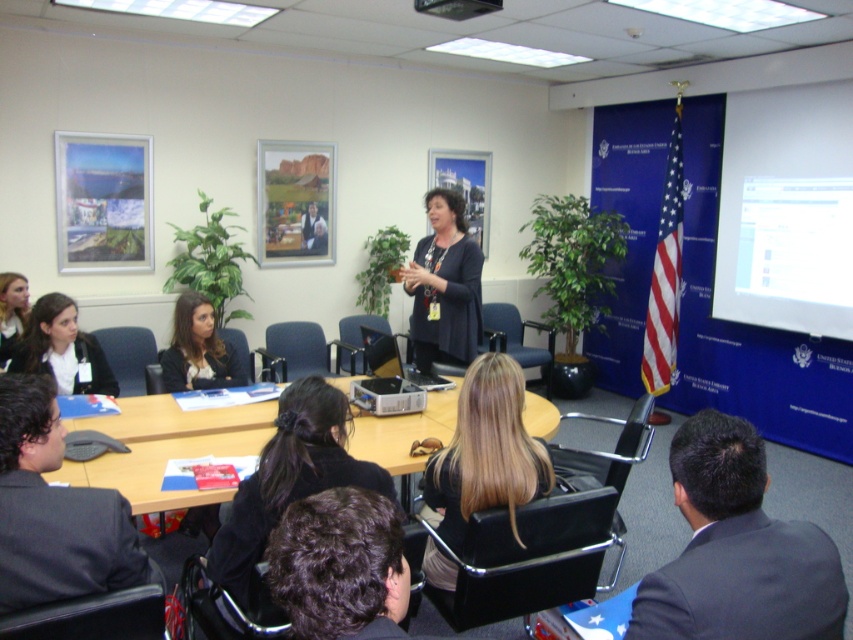
Is the position of dark gray suit at lower right more distant than that of black fabric hair at center?

No, dark gray suit at lower right is closer to the viewer.

Who is higher up, dark gray suit at lower right or black fabric hair at center?

dark gray suit at lower right is above.

Is point (680, 464) behind point (317, 456)?

No, (680, 464) is closer to viewer.

Identify the location of dark gray suit at lower right. The image size is (853, 640). (735, 550).

Does point (96, 340) come in front of point (398, 396)?

No, (96, 340) is further to viewer.

Does matte black shirt at upper left lie in front of silver metallic projector at center?

No, it is not.

The image size is (853, 640). I want to click on matte black shirt at upper left, so click(x=62, y=349).

Between white glossy projector screen at upper right and matte black jacket at lower left, which one appears on the right side from the viewer's perspective?

white glossy projector screen at upper right is more to the right.

Between white glossy projector screen at upper right and matte black jacket at lower left, which one is positioned higher?

white glossy projector screen at upper right is higher up.

Locate an element on the screen. white glossy projector screen at upper right is located at coordinates (786, 209).